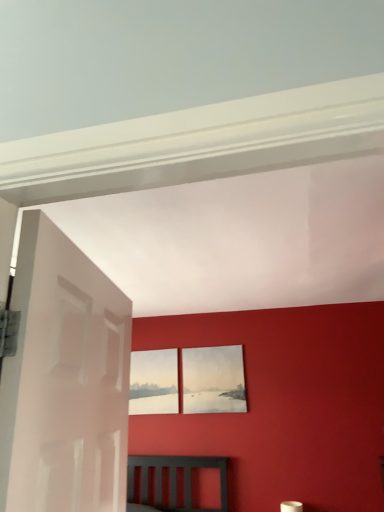
Question: Considering the relative sizes of white glossy door at left and matte white picture frame at center, marked as the 1th picture frame in a left-to-right arrangement, in the image provided, is white glossy door at left taller than matte white picture frame at center, marked as the 1th picture frame in a left-to-right arrangement,?

Choices:
 (A) no
 (B) yes

Answer: (B)

Question: Is white glossy door at left not within matte white picture frame at center, marked as the 1th picture frame in a left-to-right arrangement?

Choices:
 (A) yes
 (B) no

Answer: (A)

Question: Does white glossy door at left have a larger size compared to matte white picture frame at center, marked as the 1th picture frame in a left-to-right arrangement?

Choices:
 (A) no
 (B) yes

Answer: (B)

Question: Is white glossy door at left thinner than matte white picture frame at center, the 2th picture frame from the right?

Choices:
 (A) no
 (B) yes

Answer: (A)

Question: Does white glossy door at left lie in front of matte white picture frame at center, marked as the 1th picture frame in a left-to-right arrangement?

Choices:
 (A) no
 (B) yes

Answer: (B)

Question: Considering their positions, is matte paper picture frame at center, the 1th picture frame viewed from the right, located in front of or behind matte white picture frame at center, marked as the 1th picture frame in a left-to-right arrangement?

Choices:
 (A) behind
 (B) front

Answer: (B)

Question: Based on their sizes in the image, would you say matte paper picture frame at center, the 1th picture frame viewed from the right, is bigger or smaller than matte white picture frame at center, marked as the 1th picture frame in a left-to-right arrangement?

Choices:
 (A) small
 (B) big

Answer: (B)

Question: From their relative heights in the image, would you say matte paper picture frame at center, which appears as the 2th picture frame when viewed from the left, is taller or shorter than matte white picture frame at center, marked as the 1th picture frame in a left-to-right arrangement?

Choices:
 (A) short
 (B) tall

Answer: (B)

Question: Is matte paper picture frame at center, which appears as the 2th picture frame when viewed from the left, to the left or to the right of matte white picture frame at center, the 2th picture frame from the right, in the image?

Choices:
 (A) right
 (B) left

Answer: (A)

Question: From a real-world perspective, is white glossy door at left physically located above or below matte white picture frame at center, the 2th picture frame from the right?

Choices:
 (A) below
 (B) above

Answer: (A)

Question: From the image's perspective, relative to matte white picture frame at center, the 2th picture frame from the right, is white glossy door at left above or below?

Choices:
 (A) above
 (B) below

Answer: (A)

Question: Is white glossy door at left spatially inside matte white picture frame at center, the 2th picture frame from the right, or outside of it?

Choices:
 (A) inside
 (B) outside

Answer: (B)

Question: Would you say white glossy door at left is to the left or to the right of matte white picture frame at center, the 2th picture frame from the right, in the picture?

Choices:
 (A) left
 (B) right

Answer: (B)

Question: Considering the positions of matte paper picture frame at center, the 1th picture frame viewed from the right, and white glossy door at left in the image, is matte paper picture frame at center, the 1th picture frame viewed from the right, taller or shorter than white glossy door at left?

Choices:
 (A) short
 (B) tall

Answer: (A)

Question: From a real-world perspective, is matte paper picture frame at center, which appears as the 2th picture frame when viewed from the left, above or below white glossy door at left?

Choices:
 (A) below
 (B) above

Answer: (B)